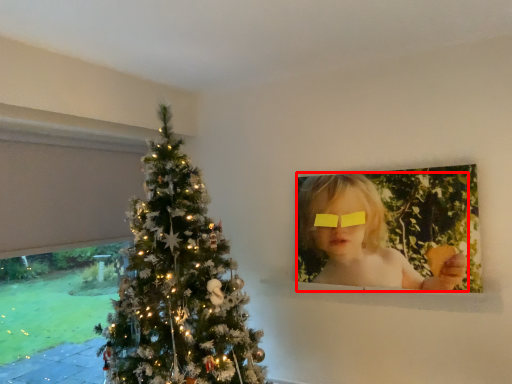
Question: Where is girl (annotated by the red box) located in relation to glasses in the image?

Choices:
 (A) left
 (B) right

Answer: (B)